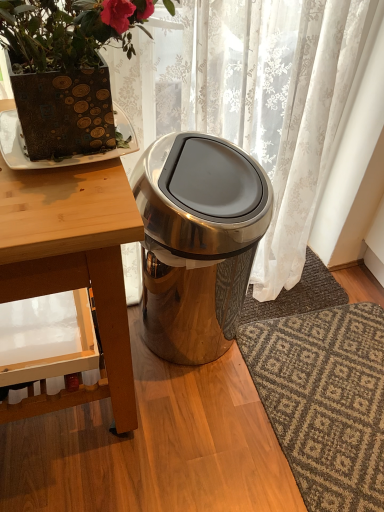
This screenshot has width=384, height=512. What are the coordinates of `free point below satin silver trash can at center (from a real-world perspective)` in the screenshot? It's located at (193, 357).